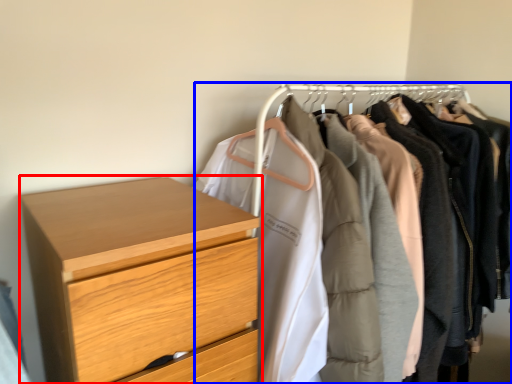
Question: Which point is further to the camera, chest of drawers (highlighted by a red box) or closet (highlighted by a blue box)?

Choices:
 (A) chest of drawers
 (B) closet

Answer: (B)